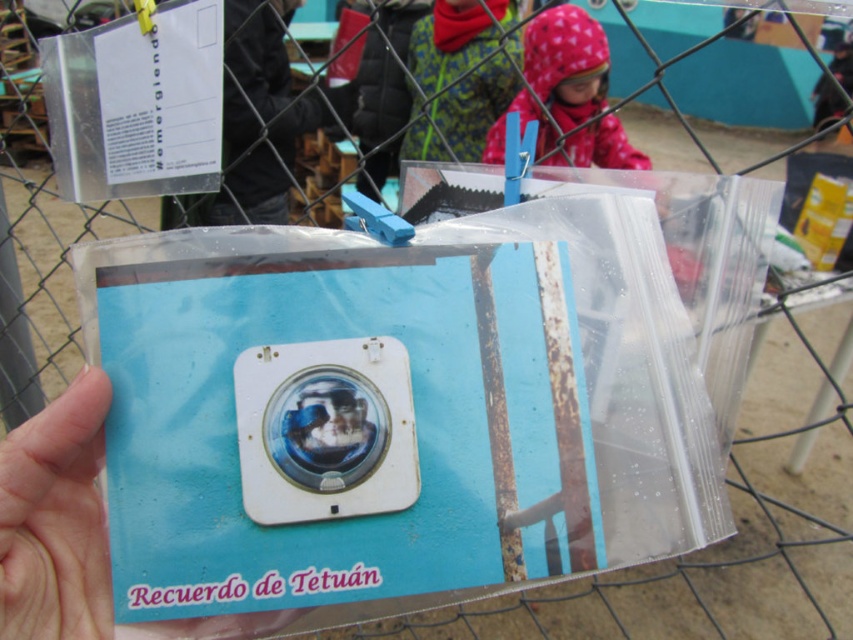
Is point (375, 403) positioned behind point (48, 540)?

Yes, it is behind point (48, 540).

Does white plastic camera at center come behind matte plastic hand at lower left?

Yes, white plastic camera at center is behind matte plastic hand at lower left.

Where is `white plastic camera at center`? This screenshot has width=853, height=640. white plastic camera at center is located at coordinates (325, 429).

Is matte plastic hand at lower left taller than fluffy pink hood at upper center?

No, matte plastic hand at lower left is not taller than fluffy pink hood at upper center.

Is matte plastic hand at lower left in front of fluffy pink hood at upper center?

That is True.

Image resolution: width=853 pixels, height=640 pixels. Describe the element at coordinates (56, 518) in the screenshot. I see `matte plastic hand at lower left` at that location.

The image size is (853, 640). Identify the location of matte plastic hand at lower left. (56, 518).

Does white plastic camera at center have a larger size compared to fluffy pink hood at upper center?

Actually, white plastic camera at center might be smaller than fluffy pink hood at upper center.

Between white plastic camera at center and fluffy pink hood at upper center, which one is positioned lower?

white plastic camera at center

Between point (320, 474) and point (569, 20), which one is positioned in front?

Positioned in front is point (320, 474).

This screenshot has height=640, width=853. In order to click on white plastic camera at center in this screenshot , I will do `click(325, 429)`.